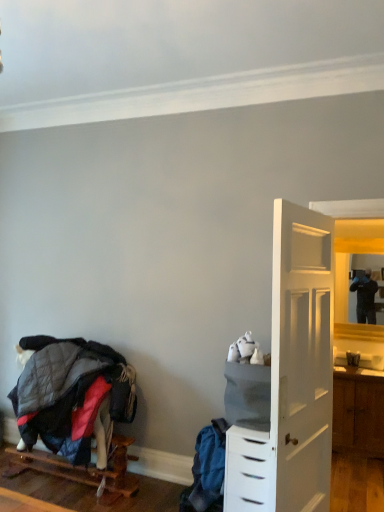
What are the coordinates of `matte wooden mirror at right` in the screenshot? It's located at (347, 307).

Measure the distance between point (339, 322) and camera.

They are 4.62 meters apart.

Find the location of a particular element. Image resolution: width=384 pixels, height=512 pixels. wooden pallet at lower left is located at coordinates (85, 469).

The height and width of the screenshot is (512, 384). What do you see at coordinates (249, 471) in the screenshot?
I see `white plastic chest of drawers at right` at bounding box center [249, 471].

Identify the location of quilted fabric bunk bed at lower left. The height and width of the screenshot is (512, 384). (72, 397).

Is matte wooden mirror at right facing away from white plastic chest of drawers at right?

No.

How many degrees apart are the facing directions of matte wooden mirror at right and white plastic chest of drawers at right?

They differ by 2.1 degrees in their facing directions.

Considering the relative sizes of matte wooden mirror at right and white plastic chest of drawers at right in the image provided, is matte wooden mirror at right shorter than white plastic chest of drawers at right?

In fact, matte wooden mirror at right may be taller than white plastic chest of drawers at right.

Could you tell me if white plastic chest of drawers at right is facing matte wooden mirror at right?

No, white plastic chest of drawers at right is not turned towards matte wooden mirror at right.

Does white plastic chest of drawers at right appear on the left side of matte wooden mirror at right?

Correct, you'll find white plastic chest of drawers at right to the left of matte wooden mirror at right.

From the image's perspective, is white plastic chest of drawers at right located above or below matte wooden mirror at right?

From the image's perspective, white plastic chest of drawers at right appears below matte wooden mirror at right.

Would you say white plastic chest of drawers at right contains matte wooden mirror at right?

Definitely not — matte wooden mirror at right is not inside white plastic chest of drawers at right.

Where is `bunk bed above the wooden pallet at lower left (from a real-world perspective)`? bunk bed above the wooden pallet at lower left (from a real-world perspective) is located at coordinates (72, 397).

Can you confirm if wooden pallet at lower left is wider than quilted fabric bunk bed at lower left?

Correct, the width of wooden pallet at lower left exceeds that of quilted fabric bunk bed at lower left.

Is white plastic chest of drawers at right oriented towards quilted fabric bunk bed at lower left?

No, white plastic chest of drawers at right is not aimed at quilted fabric bunk bed at lower left.

Does point (268, 463) lie in front of point (13, 395)?

Yes, point (268, 463) is in front of point (13, 395).

From a real-world perspective, is white plastic chest of drawers at right over quilted fabric bunk bed at lower left?

Incorrect, from a real-world perspective, white plastic chest of drawers at right is lower than quilted fabric bunk bed at lower left.

Is white plastic chest of drawers at right bigger or smaller than quilted fabric bunk bed at lower left?

white plastic chest of drawers at right is bigger than quilted fabric bunk bed at lower left.

Is quilted fabric bunk bed at lower left shorter than matte wooden mirror at right?

Yes.

Can you confirm if quilted fabric bunk bed at lower left is positioned to the left of matte wooden mirror at right?

Indeed, quilted fabric bunk bed at lower left is positioned on the left side of matte wooden mirror at right.

The height and width of the screenshot is (512, 384). Find the location of `bunk bed below the matte wooden mirror at right (from the image's perspective)`. bunk bed below the matte wooden mirror at right (from the image's perspective) is located at coordinates (72, 397).

Consider the image. Looking at the image, does matte wooden mirror at right seem bigger or smaller compared to quilted fabric bunk bed at lower left?

Clearly, matte wooden mirror at right is smaller in size than quilted fabric bunk bed at lower left.

From a real-world perspective, does matte wooden mirror at right sit lower than quilted fabric bunk bed at lower left?

Incorrect, from a real-world perspective, matte wooden mirror at right is higher than quilted fabric bunk bed at lower left.

From the image's perspective, which object appears higher, matte wooden mirror at right or quilted fabric bunk bed at lower left?

matte wooden mirror at right, from the image's perspective.

Is matte wooden mirror at right next to wooden pallet at lower left and touching it?

They are not placed beside each other.

From the image's perspective, is matte wooden mirror at right located beneath wooden pallet at lower left?

No, from the image's perspective, matte wooden mirror at right is not below wooden pallet at lower left.

Is matte wooden mirror at right shorter than wooden pallet at lower left?

Incorrect, the height of matte wooden mirror at right does not fall short of that of wooden pallet at lower left.

Is wooden pallet at lower left a part of matte wooden mirror at right?

No.

Locate an element on the screen. This screenshot has height=512, width=384. chest of drawers below the matte wooden mirror at right (from a real-world perspective) is located at coordinates (249, 471).

I want to click on mirror above the white plastic chest of drawers at right (from a real-world perspective), so coord(347,307).

Consider the image. When comparing their distances from wooden pallet at lower left, does quilted fabric bunk bed at lower left or white plastic chest of drawers at right seem closer?

Among the two, quilted fabric bunk bed at lower left is located nearer to wooden pallet at lower left.

Looking at this image, from the image, which object appears to be farther from quilted fabric bunk bed at lower left, matte wooden mirror at right or wooden pallet at lower left?

matte wooden mirror at right is positioned further to the anchor quilted fabric bunk bed at lower left.

From the image, which object appears to be nearer to quilted fabric bunk bed at lower left, matte wooden mirror at right or white plastic chest of drawers at right?

white plastic chest of drawers at right is closer to quilted fabric bunk bed at lower left.

Based on the photo, estimate the real-world distances between objects in this image. Which object is closer to matte wooden mirror at right, white plastic chest of drawers at right or wooden pallet at lower left?

The object closer to matte wooden mirror at right is white plastic chest of drawers at right.

Which object lies nearer to the anchor point matte wooden mirror at right, wooden pallet at lower left or quilted fabric bunk bed at lower left?

quilted fabric bunk bed at lower left is positioned closer to the anchor matte wooden mirror at right.

Looking at this image, when comparing their distances from quilted fabric bunk bed at lower left, does white plastic chest of drawers at right or wooden pallet at lower left seem further?

Based on the image, white plastic chest of drawers at right appears to be further to quilted fabric bunk bed at lower left.

Considering their positions, is matte wooden mirror at right positioned further to wooden pallet at lower left than quilted fabric bunk bed at lower left?

matte wooden mirror at right lies further to wooden pallet at lower left than the other object.

From the image, which object appears to be farther from wooden pallet at lower left, white plastic chest of drawers at right or matte wooden mirror at right?

matte wooden mirror at right lies further to wooden pallet at lower left than the other object.

You are a GUI agent. You are given a task and a screenshot of the screen. Output one action in this format:
    pyautogui.click(x=<x>, y=<y>)
    Task: Click on the chest of drawers between quilted fabric bunk bed at lower left and matte wooden mirror at right from left to right
    
    Given the screenshot: What is the action you would take?
    pyautogui.click(x=249, y=471)

Where is `the chest of drawers located between wooden pallet at lower left and matte wooden mirror at right in the left-right direction`? the chest of drawers located between wooden pallet at lower left and matte wooden mirror at right in the left-right direction is located at coordinates (249, 471).

Find the location of `bunk bed situated between wooden pallet at lower left and matte wooden mirror at right from left to right`. bunk bed situated between wooden pallet at lower left and matte wooden mirror at right from left to right is located at coordinates (72, 397).

At what (x,y) coordinates should I click in order to perform the action: click on bunk bed situated between wooden pallet at lower left and white plastic chest of drawers at right from left to right. Please return your answer as a coordinate pair (x, y). The image size is (384, 512). Looking at the image, I should click on (72, 397).